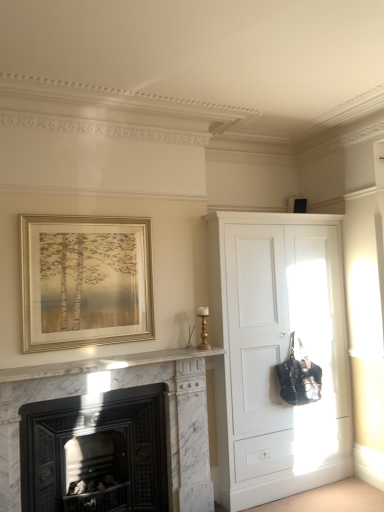
Locate an element on the screen. This screenshot has width=384, height=512. free space above gold metallic frame at upper left (from a real-world perspective) is located at coordinates (85, 212).